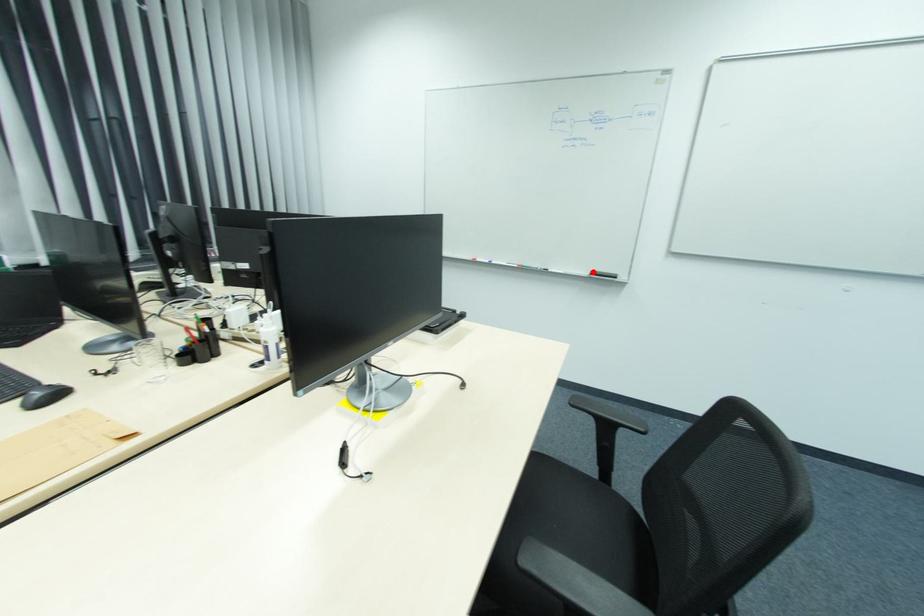
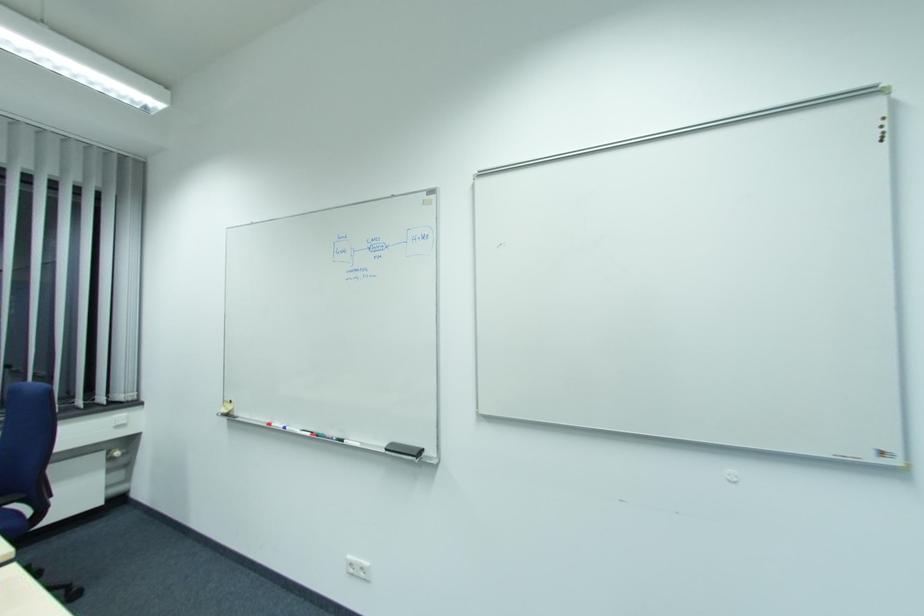
Where in the second image is the point corresponding to the highlighted location from the first image?

(392, 444)